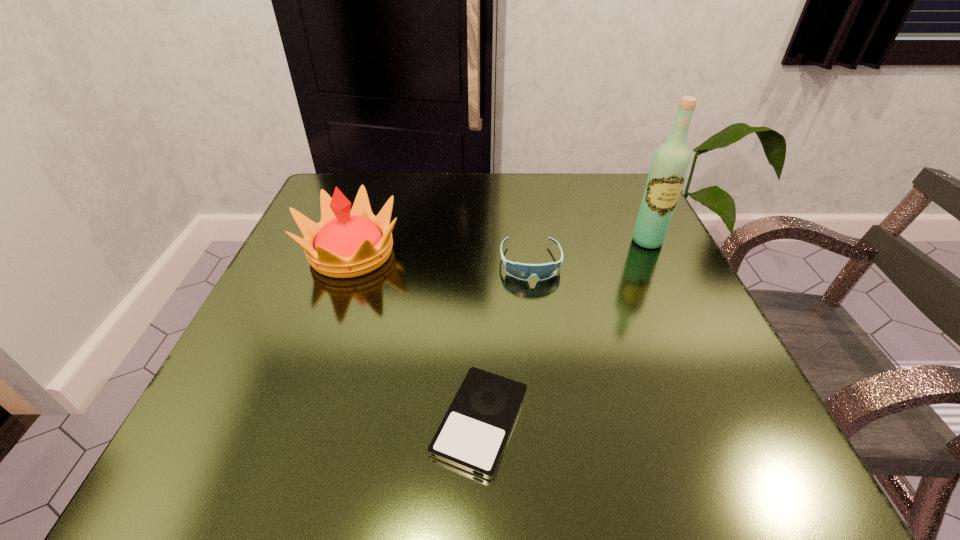
Image resolution: width=960 pixels, height=540 pixels. I want to click on empty space that is in between the second shortest object and the third shortest object, so click(441, 258).

At what (x,y) coordinates should I click in order to perform the action: click on empty location between the tallest object and the leftmost object. Please return your answer as a coordinate pair (x, y). Looking at the image, I should click on (499, 247).

Identify which object is the third closest to the shortest object. Please provide its 2D coordinates. Your answer should be formatted as a tuple, i.e. [(x, y)], where the tuple contains the x and y coordinates of a point satisfying the conditions above.

[(669, 167)]

Find the location of `the closest object to the rightmost object`. the closest object to the rightmost object is located at coordinates (521, 271).

You are a GUI agent. You are given a task and a screenshot of the screen. Output one action in this format:
    pyautogui.click(x=<x>, y=<y>)
    Task: Click on the free space that satisfies the following two spatial constraints: 1. on the front side of the leftmost object; 2. on the right side of the shortest object
    
    Given the screenshot: What is the action you would take?
    pyautogui.click(x=292, y=421)